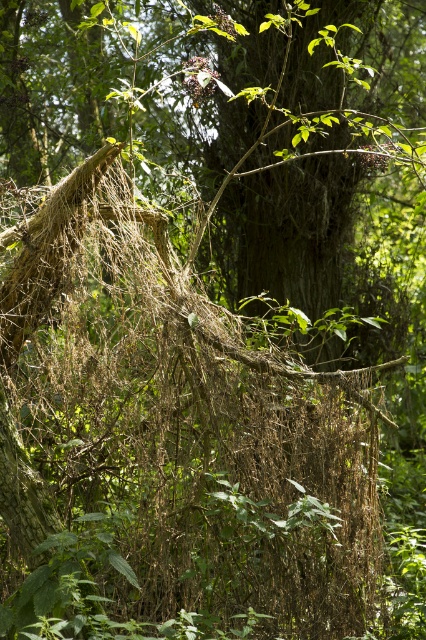
Is brown dried grass at center taller than brown rough bark tree trunk at center?

Incorrect, brown dried grass at center's height is not larger of brown rough bark tree trunk at center's.

Who is more forward, (209, 330) or (236, 77)?

Point (209, 330) is more forward.

Locate an element on the screen. This screenshot has width=426, height=640. brown dried grass at center is located at coordinates (169, 440).